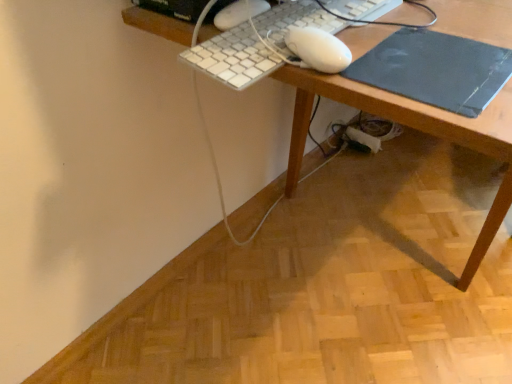
Find the location of `unoccupied space behind black matte mousepad at right`. unoccupied space behind black matte mousepad at right is located at coordinates (426, 22).